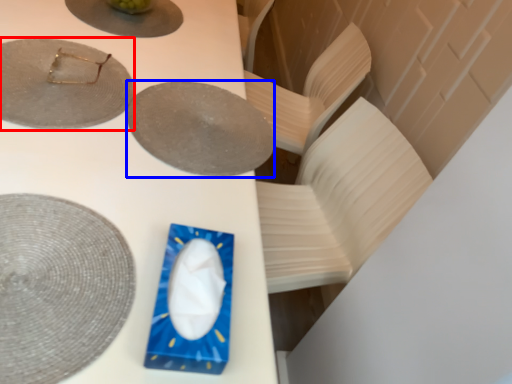
Question: Which object appears closest to the camera in this image, plate (highlighted by a red box) or plate (highlighted by a blue box)?

Choices:
 (A) plate
 (B) plate

Answer: (A)